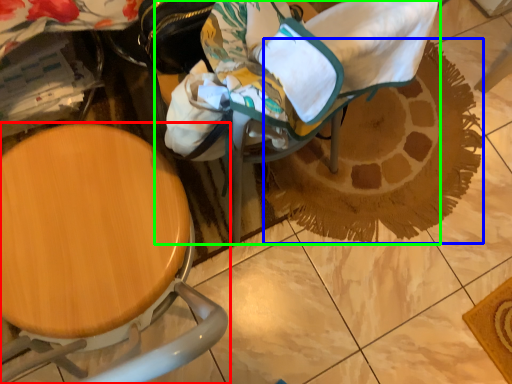
Question: Based on their relative distances, which object is nearer to chair (highlighted by a red box)? Choose from doormat (highlighted by a blue box) and baby carriage (highlighted by a green box).

Choices:
 (A) doormat
 (B) baby carriage

Answer: (B)